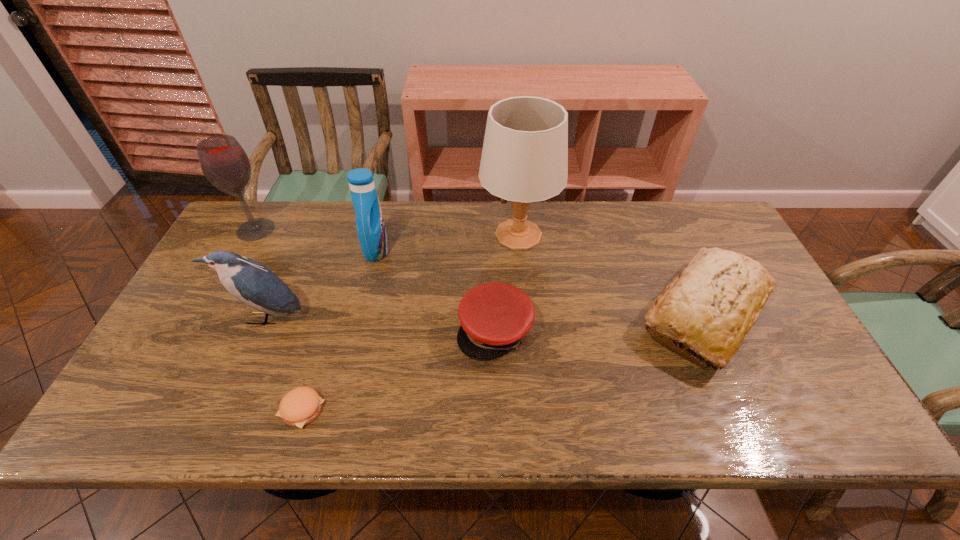
Identify the location of vacant area situated 0.150m on the right of the alcohol. (322, 230).

This screenshot has height=540, width=960. I want to click on free space located on the front-facing side of the detergent, so click(x=464, y=251).

What are the coordinates of `blank space located at the tip of the bird's beak` in the screenshot? It's located at (250, 354).

You are a GUI agent. You are given a task and a screenshot of the screen. Output one action in this format:
    pyautogui.click(x=<x>, y=<y>)
    Task: Click on the vacant space located 0.400m on the left of the rightmost object
    This screenshot has height=540, width=960.
    Given the screenshot: What is the action you would take?
    pyautogui.click(x=482, y=314)

What are the coordinates of `free space located at the front of the second shortest object where the visor is located` in the screenshot? It's located at (498, 433).

This screenshot has width=960, height=540. Find the location of `vacant space situated on the right of the shortest object`. vacant space situated on the right of the shortest object is located at coordinates (431, 410).

This screenshot has width=960, height=540. In order to click on table lamp that is at the far edge in this screenshot , I will do `click(524, 159)`.

Find the location of `alcohol at the far edge`. alcohol at the far edge is located at coordinates (223, 161).

Find the location of a particular element. detergent that is at the far edge is located at coordinates (370, 225).

This screenshot has height=540, width=960. What are the coordinates of `object that is positioned at the near edge` in the screenshot? It's located at coord(300,406).